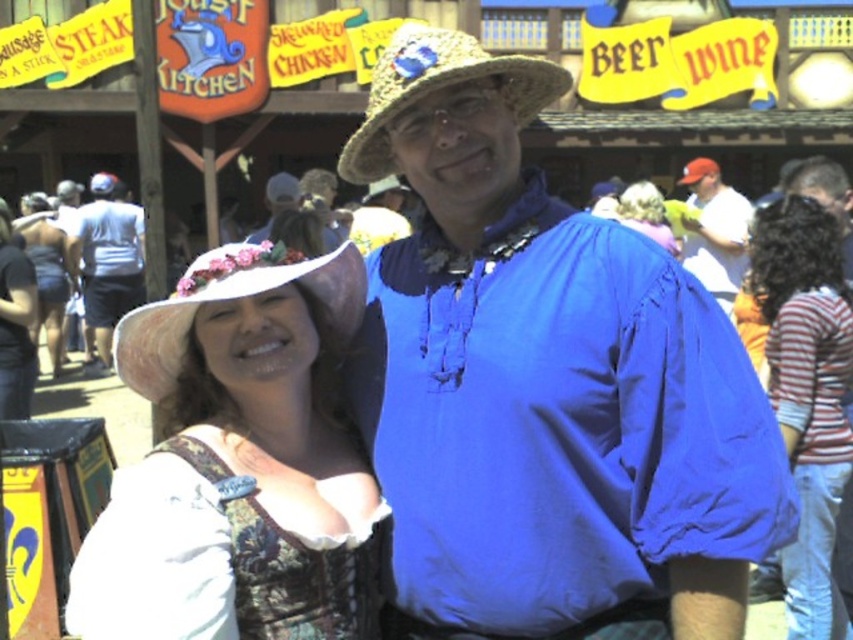
Question: Considering the relative positions of white straw hat at center and red baseball cap at upper right in the image provided, where is white straw hat at center located with respect to red baseball cap at upper right?

Choices:
 (A) below
 (B) above

Answer: (A)

Question: Among these points, which one is farthest from the camera?

Choices:
 (A) (12, 358)
 (B) (662, 220)
 (C) (317, 268)

Answer: (B)

Question: Is striped cotton shirt at right below matte white shirt at left?

Choices:
 (A) yes
 (B) no

Answer: (A)

Question: Which point appears closest to the camera in this image?

Choices:
 (A) (33, 289)
 (B) (39, 321)

Answer: (A)

Question: Can you confirm if straw hat at center is bigger than matte white hat at upper center?

Choices:
 (A) yes
 (B) no

Answer: (A)

Question: Which point appears farthest from the camera in this image?

Choices:
 (A) (659, 237)
 (B) (114, 237)
 (C) (712, 228)
 (D) (258, 548)

Answer: (B)